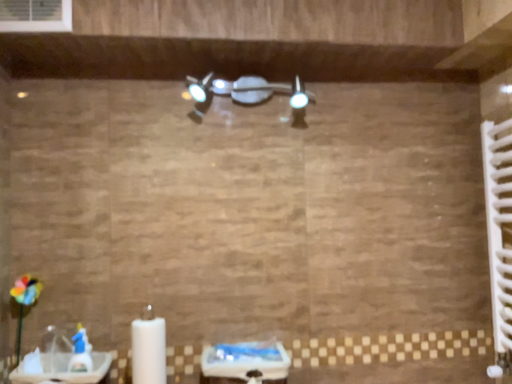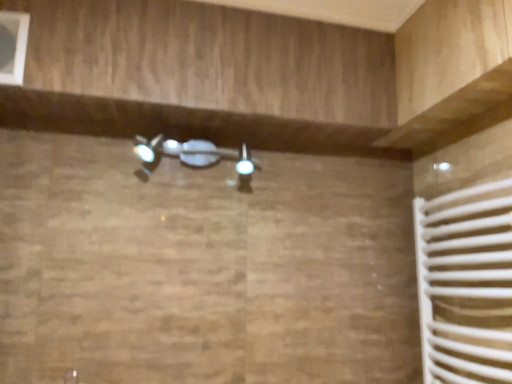
Question: Which way did the camera rotate in the video?

Choices:
 (A) rotated left
 (B) rotated right

Answer: (B)